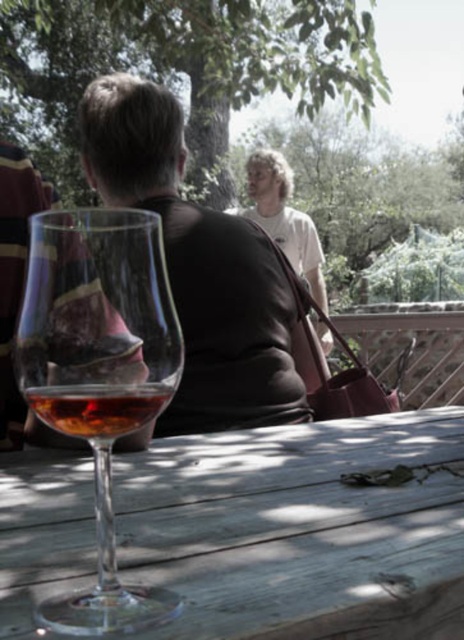
Question: Which object is the closest to the amber glass at center?

Choices:
 (A) transparent glass wine glass at lower left
 (B) white cotton shirt at upper center

Answer: (A)

Question: Which point appears closest to the camera in this image?

Choices:
 (A) (141, 378)
 (B) (173, 428)

Answer: (A)

Question: Among these objects, which one is nearest to the camera?

Choices:
 (A) wooden table at center
 (B) transparent glass wine glass at lower left

Answer: (A)

Question: Can you confirm if wooden table at center is positioned below white cotton shirt at upper center?

Choices:
 (A) no
 (B) yes

Answer: (B)

Question: Does wooden table at center have a greater width compared to brown leather jacket at upper center?

Choices:
 (A) no
 (B) yes

Answer: (B)

Question: Is wooden table at center further to the viewer compared to transparent glass wine glass at lower left?

Choices:
 (A) no
 (B) yes

Answer: (A)